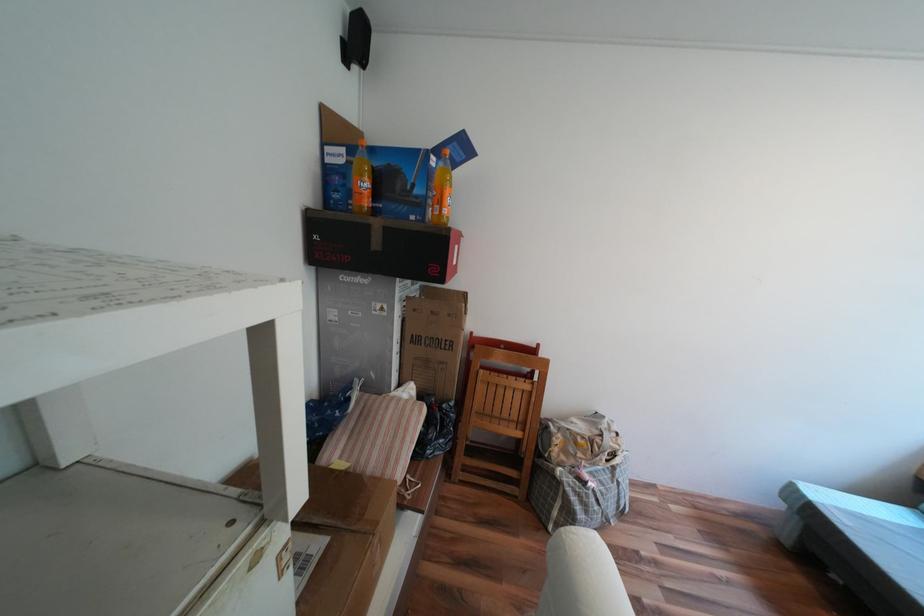
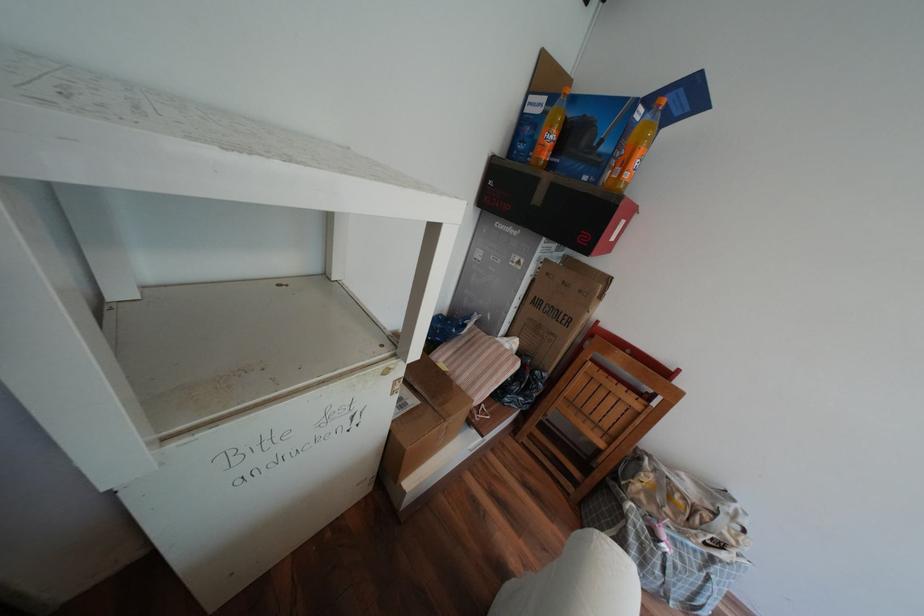
Find the pixel in the second image that matches point (378, 227) in the first image.

(545, 180)